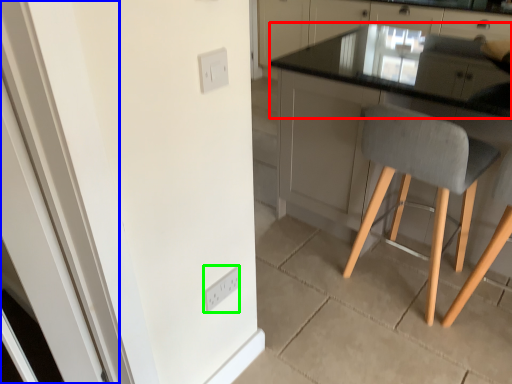
Question: Which object is the closest to the countertop (highlighted by a red box)? Choose among these: screen door (highlighted by a blue box) or light switch (highlighted by a green box).

Choices:
 (A) screen door
 (B) light switch

Answer: (B)